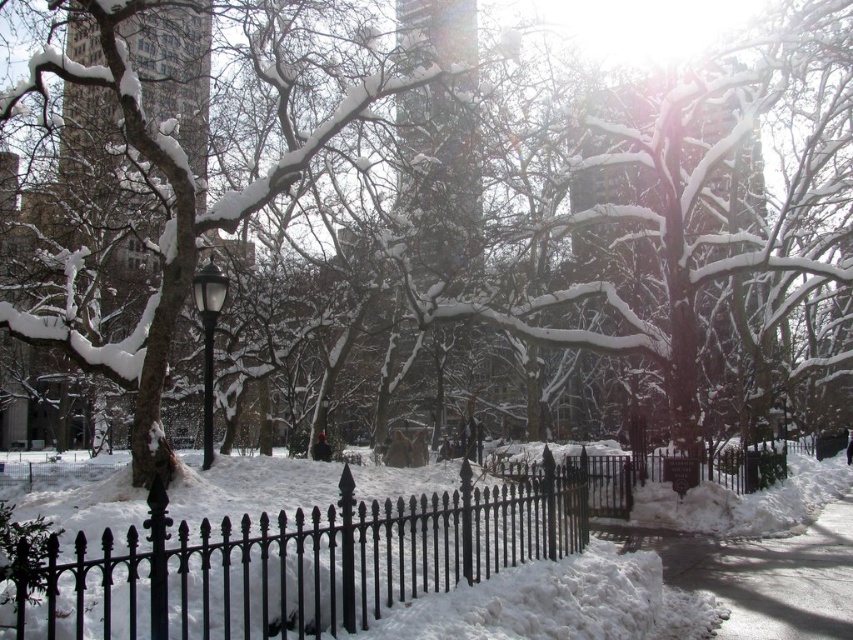
Is black wrought iron fence at center bigger than snow-covered tree at center?

Incorrect, black wrought iron fence at center is not larger than snow-covered tree at center.

Measure the distance from black wrought iron fence at center to snow-covered tree at center.

33.17 feet

Between point (61, 582) and point (154, 163), which one is positioned in front?

Point (61, 582) is more forward.

Find the location of `black wrought iron fence at center`. black wrought iron fence at center is located at coordinates (305, 561).

Who is positioned more to the right, black wrought iron fence at center or black matte lamp post at center-left?

black wrought iron fence at center

Which is behind, point (184, 589) or point (221, 298)?

The point (221, 298) is behind.

You are a GUI agent. You are given a task and a screenshot of the screen. Output one action in this format:
    pyautogui.click(x=<x>, y=<y>)
    Task: Click on the black wrought iron fence at center
    
    Given the screenshot: What is the action you would take?
    pyautogui.click(x=305, y=561)

This screenshot has width=853, height=640. I want to click on black wrought iron fence at center, so click(x=305, y=561).

Consider the image. Does smooth glass tower at center appear on the right side of white snow at lower right?

Incorrect, smooth glass tower at center is not on the right side of white snow at lower right.

Does point (410, 276) lie in front of point (851, 573)?

No, (410, 276) is behind (851, 573).

Locate an element on the screen. The width and height of the screenshot is (853, 640). smooth glass tower at center is located at coordinates (440, 144).